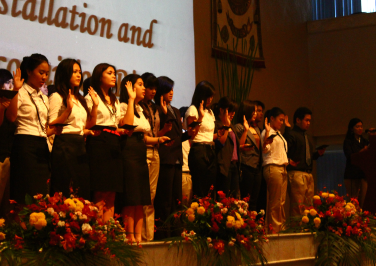
Find the location of a particular element. bunches of flowers is located at coordinates (340, 208), (246, 216), (74, 225).